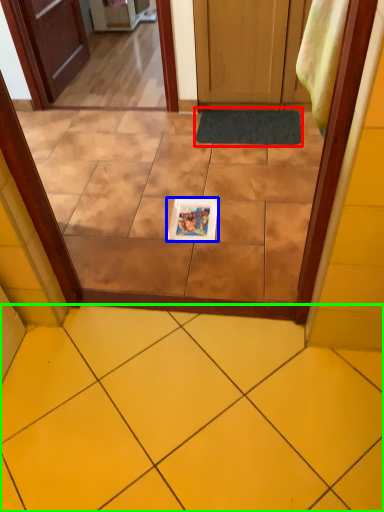
Question: Considering the real-world distances, which object is closest to doormat (highlighted by a red box)? magazine (highlighted by a blue box) or ceramic tile (highlighted by a green box).

Choices:
 (A) magazine
 (B) ceramic tile

Answer: (A)